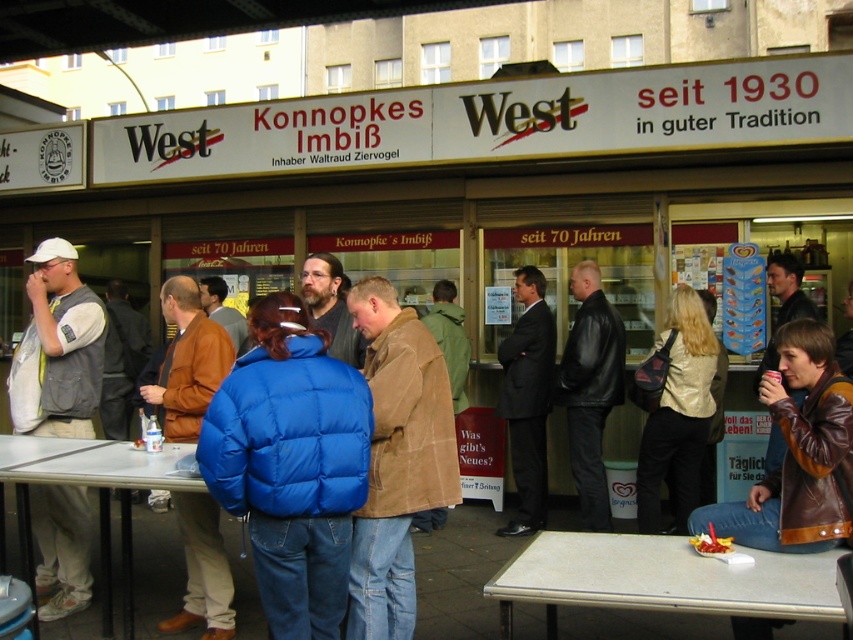
Measure the distance between white laminate table at lower right and brown leather jacket at lower right.

A distance of 18.44 inches exists between white laminate table at lower right and brown leather jacket at lower right.

Find the location of a particular element. white laminate table at lower right is located at coordinates pos(660,579).

Between puffy blue jacket at center and brown suede jacket at center, which one has more height?

brown suede jacket at center

Can you confirm if puffy blue jacket at center is thinner than brown suede jacket at center?

In fact, puffy blue jacket at center might be wider than brown suede jacket at center.

Describe the element at coordinates (291, 465) in the screenshot. The height and width of the screenshot is (640, 853). I see `puffy blue jacket at center` at that location.

Find the location of `puffy blue jacket at center`. puffy blue jacket at center is located at coordinates (291, 465).

Between metallic silver table at lower left and smooth plastic chips at center, which one has less height?

smooth plastic chips at center

Does metallic silver table at lower left come in front of smooth plastic chips at center?

No, metallic silver table at lower left is further to the viewer.

Does point (132, 612) lie in front of point (693, 547)?

No, it is behind (693, 547).

What are the coordinates of `metallic silver table at lower left` in the screenshot? It's located at (91, 464).